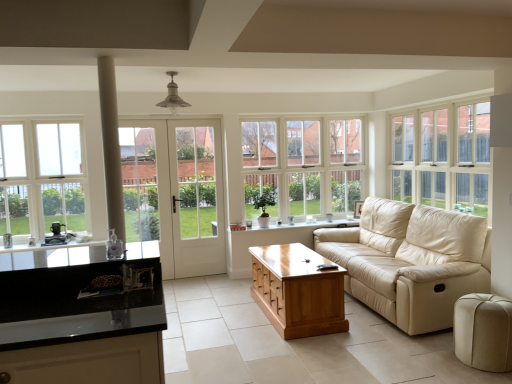
Question: Can you confirm if beige velvet ottoman at lower right is shorter than black glossy countertop at lower left?

Choices:
 (A) yes
 (B) no

Answer: (B)

Question: Is beige velvet ottoman at lower right not within black glossy countertop at lower left?

Choices:
 (A) no
 (B) yes

Answer: (B)

Question: Is the position of beige velvet ottoman at lower right less distant than that of black glossy countertop at lower left?

Choices:
 (A) no
 (B) yes

Answer: (A)

Question: Is beige velvet ottoman at lower right wider than black glossy countertop at lower left?

Choices:
 (A) yes
 (B) no

Answer: (B)

Question: From the image's perspective, is beige velvet ottoman at lower right under black glossy countertop at lower left?

Choices:
 (A) yes
 (B) no

Answer: (A)

Question: Is beige velvet ottoman at lower right not near black glossy countertop at lower left?

Choices:
 (A) yes
 (B) no

Answer: (A)

Question: Is black glossy countertop at lower left at the back of white wood window at center, which is the second window from left to right?

Choices:
 (A) yes
 (B) no

Answer: (B)

Question: Is white wood window at center, which is the second window from left to right, taller than black glossy countertop at lower left?

Choices:
 (A) no
 (B) yes

Answer: (B)

Question: Is white wood window at center, which is the second window from left to right, bigger than black glossy countertop at lower left?

Choices:
 (A) no
 (B) yes

Answer: (B)

Question: Could you tell me if white wood window at center, placed as the 2th window when sorted from right to left, is facing black glossy countertop at lower left?

Choices:
 (A) no
 (B) yes

Answer: (A)

Question: Considering the relative sizes of white wood window at center, which is the second window from left to right, and black glossy countertop at lower left in the image provided, is white wood window at center, which is the second window from left to right, smaller than black glossy countertop at lower left?

Choices:
 (A) no
 (B) yes

Answer: (A)

Question: Considering the relative positions of white wood window at center, which is the second window from left to right, and black glossy countertop at lower left in the image provided, is white wood window at center, which is the second window from left to right, in front of black glossy countertop at lower left?

Choices:
 (A) no
 (B) yes

Answer: (A)

Question: Does white wood window at upper right, arranged as the third window when viewed from the left, have a larger size compared to black glossy countertop at lower left?

Choices:
 (A) yes
 (B) no

Answer: (A)